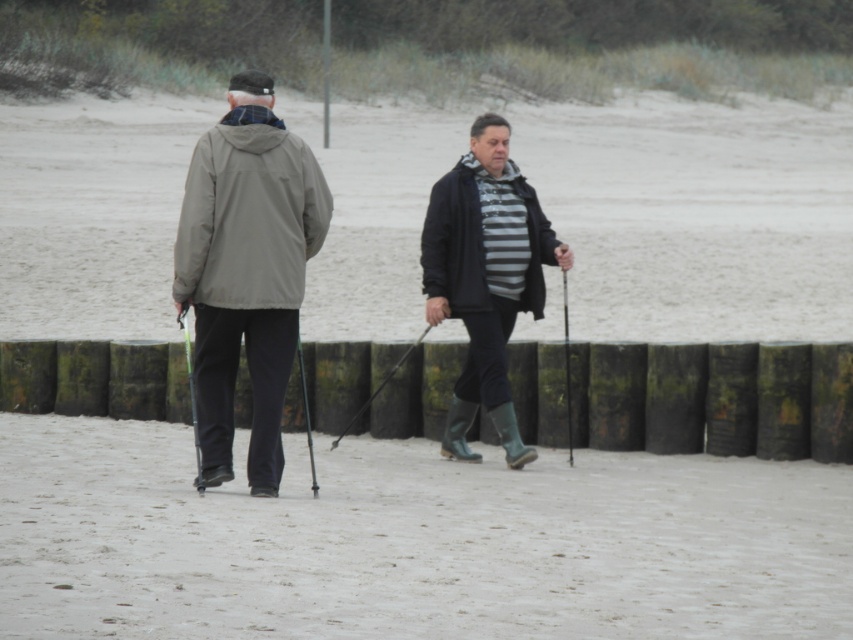
You are standing on the beach and want to reach a specific point marked at coordinates (328, 93). If you start walking directly towards this point from your current position, how far will you have to walk?

The point at coordinates (328, 93) is 61.24 meters away from the viewer, so you will have to walk 61.24 meters to reach it.

You are a photographer trying to capture the matte gray jacket at center. Given that the camera focuses on the point at coordinates point (244, 272), will the matte gray jacket at center be in focus?

The matte gray jacket at center is represented by point (244, 272), so yes, the jacket will be in focus as the camera focuses on that exact point.

You are a photographer standing at the edge of the beach. You want to take a photo that includes both the matte gray jacket at center and the green plastic ski pole at left. Based on their positions, which object should you focus on first to ensure both are in clear focus?

The matte gray jacket at center is closer to you than the green plastic ski pole at left. To ensure both are in clear focus, you should focus on the matte gray jacket at center first.